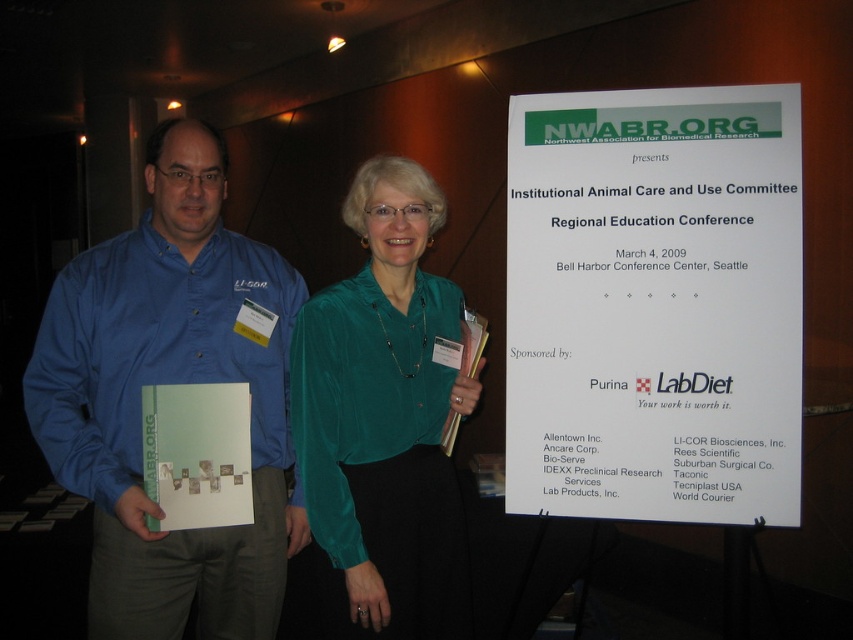
You are a photographer adjusting your camera settings to focus on two specific points in the image. The first point is at coordinates point (132, 589) and the second is at point (390, 461). Which point should you prioritize focusing on to ensure the subject closest to the camera is sharp?

Point (132, 589) should be prioritized because it is closer to the camera than point (390, 461).

You are standing at the point marked by the coordinate point at [297,276]. You want to greet both people in the image. Which person should you approach first to minimize the total distance walked?

Since the two individuals are 1.99 meters apart, you should approach the person closer to your starting point first to minimize the total distance walked. However, without knowing the exact positions of each person relative to the starting point, it is impossible to determine which one is closer.

You are an event photographer who needs to capture a group photo of the blue shirt at left and the emerald satin blouse at center. Based on their current positions, which direction should you move to frame both subjects equally in the camera viewfinder?

Since the blue shirt at left is positioned on the left side of the emerald satin blouse at center, you should move to the right to ensure both subjects are centered and equally framed in the camera viewfinder.